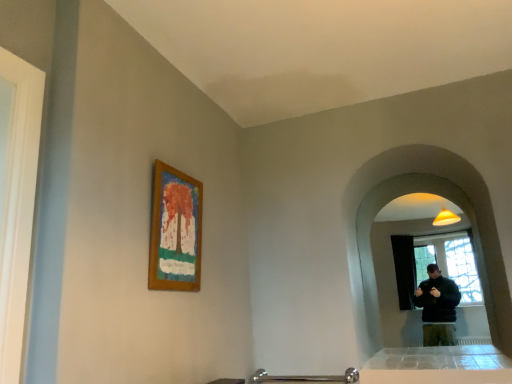
Describe the element at coordinates (444, 197) in the screenshot. This screenshot has width=512, height=384. I see `matte glass mirror at right` at that location.

You are a GUI agent. You are given a task and a screenshot of the screen. Output one action in this format:
    pyautogui.click(x=<x>, y=<y>)
    Task: Click on the matte glass mirror at right
    This screenshot has width=512, height=384.
    Given the screenshot: What is the action you would take?
    pyautogui.click(x=444, y=197)

Image resolution: width=512 pixels, height=384 pixels. Describe the element at coordinates (175, 231) in the screenshot. I see `wooden frame at upper center` at that location.

Find the location of a particular element. wooden frame at upper center is located at coordinates (175, 231).

From the picture: What is the approximate height of wooden frame at upper center?

wooden frame at upper center is 22.50 inches tall.

Locate an element on the screen. The height and width of the screenshot is (384, 512). matte glass mirror at right is located at coordinates (444, 197).

Can you confirm if wooden frame at upper center is positioned to the right of matte glass mirror at right?

Incorrect, wooden frame at upper center is not on the right side of matte glass mirror at right.

Consider the image. Is wooden frame at upper center in front of or behind matte glass mirror at right in the image?

Clearly, wooden frame at upper center is in front of matte glass mirror at right.

Which is nearer, (195, 225) or (397, 187)?

Point (195, 225)

From the image's perspective, which object appears higher, wooden frame at upper center or matte glass mirror at right?

wooden frame at upper center appears higher in the image.

From a real-world perspective, does wooden frame at upper center sit lower than matte glass mirror at right?

No, from a real-world perspective, wooden frame at upper center is not under matte glass mirror at right.

Can you confirm if wooden frame at upper center is thinner than matte glass mirror at right?

Correct, the width of wooden frame at upper center is less than that of matte glass mirror at right.

Can you confirm if wooden frame at upper center is shorter than matte glass mirror at right?

Yes, wooden frame at upper center is shorter than matte glass mirror at right.

Considering the sizes of objects wooden frame at upper center and matte glass mirror at right in the image provided, who is smaller, wooden frame at upper center or matte glass mirror at right?

wooden frame at upper center.

Can we say wooden frame at upper center lies outside matte glass mirror at right?

Yes.

In the scene shown: Are wooden frame at upper center and matte glass mirror at right far apart?

Yes.

Is wooden frame at upper center oriented towards matte glass mirror at right?

No.

How different are the orientations of wooden frame at upper center and matte glass mirror at right in degrees?

90.6 degrees.

This screenshot has height=384, width=512. Identify the location of mirror lying on the right of wooden frame at upper center. (444, 197).

Which is more to the left, matte glass mirror at right or wooden frame at upper center?

From the viewer's perspective, wooden frame at upper center appears more on the left side.

Is matte glass mirror at right in front of or behind wooden frame at upper center in the image?

In the image, matte glass mirror at right appears behind wooden frame at upper center.

Which is behind, point (375, 191) or point (188, 253)?

The point (375, 191) is farther.

From the image's perspective, is matte glass mirror at right beneath wooden frame at upper center?

Yes, from the image's perspective, matte glass mirror at right is beneath wooden frame at upper center.

From a real-world perspective, who is located lower, matte glass mirror at right or wooden frame at upper center?

In real-world perspective, matte glass mirror at right is lower.

From the picture: Which of these two, matte glass mirror at right or wooden frame at upper center, is thinner?

wooden frame at upper center is thinner.

Considering the sizes of objects matte glass mirror at right and wooden frame at upper center in the image provided, who is shorter, matte glass mirror at right or wooden frame at upper center?

wooden frame at upper center is shorter.

Is matte glass mirror at right smaller than wooden frame at upper center?

No, matte glass mirror at right is not smaller than wooden frame at upper center.

Is matte glass mirror at right located outside wooden frame at upper center?

Indeed, matte glass mirror at right is completely outside wooden frame at upper center.

Can you see matte glass mirror at right touching wooden frame at upper center?

There is a gap between matte glass mirror at right and wooden frame at upper center.

Is wooden frame at upper center at the back of matte glass mirror at right?

No, wooden frame at upper center is not at the back of matte glass mirror at right.

Where is `picture frame on the left of matte glass mirror at right`? picture frame on the left of matte glass mirror at right is located at coordinates (175, 231).

Locate an element on the screen. picture frame above the matte glass mirror at right (from the image's perspective) is located at coordinates (175, 231).

Find the location of `picture frame on the left side of matte glass mirror at right`. picture frame on the left side of matte glass mirror at right is located at coordinates (175, 231).